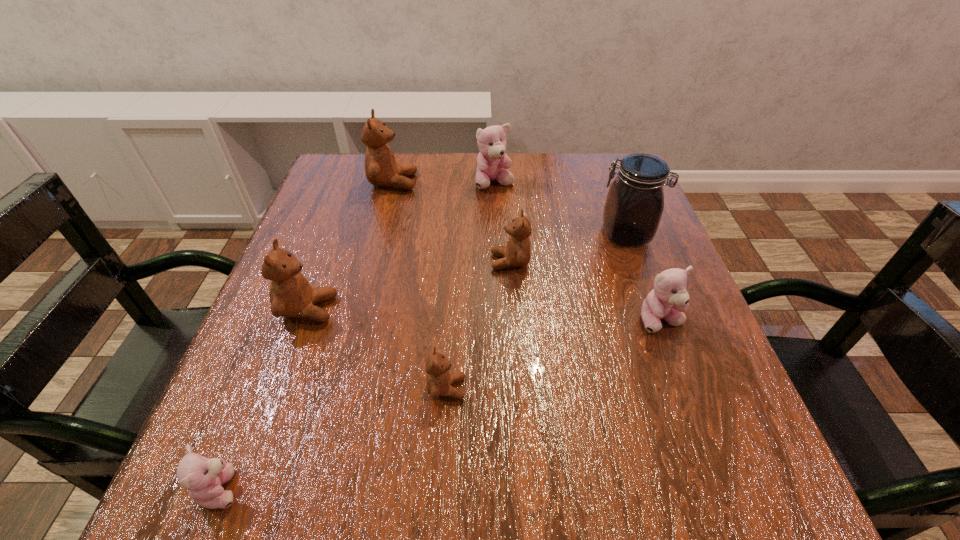
Locate an element on the screen. This screenshot has height=540, width=960. vacant space located 0.070m on the face of the third biggest brown teddy bear is located at coordinates (457, 262).

Locate an element on the screen. free location located on the face of the third biggest brown teddy bear is located at coordinates (462, 262).

Image resolution: width=960 pixels, height=540 pixels. In order to click on vacant space situated on the face of the third biggest brown teddy bear in this screenshot , I will do tap(438, 262).

Where is `vacant space located 0.280m at the face of the second smallest pink teddy bear`? The image size is (960, 540). vacant space located 0.280m at the face of the second smallest pink teddy bear is located at coordinates (732, 510).

Locate an element on the screen. vacant space situated on the face of the second nearest object is located at coordinates (553, 388).

Locate an element on the screen. blank space located 0.250m at the face of the nearest teddy bear is located at coordinates (428, 488).

You are a GUI agent. You are given a task and a screenshot of the screen. Output one action in this format:
    pyautogui.click(x=<x>, y=<y>)
    Task: Click on the object that is at the near edge
    This screenshot has height=540, width=960.
    Given the screenshot: What is the action you would take?
    pyautogui.click(x=203, y=478)

Locate an element on the screen. The width and height of the screenshot is (960, 540). jar at the right edge is located at coordinates (634, 205).

The width and height of the screenshot is (960, 540). In order to click on teddy bear that is at the right edge in this screenshot , I will do `click(668, 300)`.

Where is `object at the far left corner`? object at the far left corner is located at coordinates (381, 169).